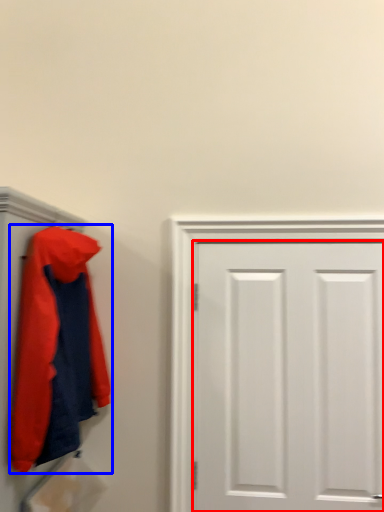
Question: Among these objects, which one is farthest to the camera, door (highlighted by a red box) or jacket (highlighted by a blue box)?

Choices:
 (A) door
 (B) jacket

Answer: (A)